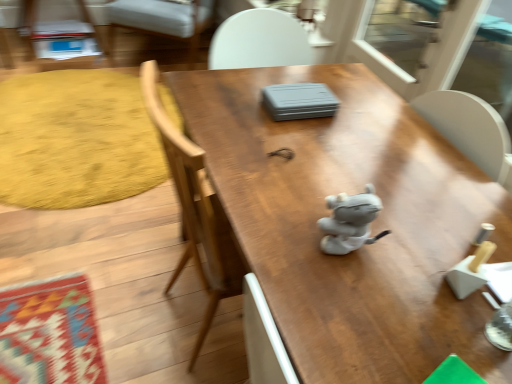
The image size is (512, 384). Find the location of `vacant space in front of gray fabric toy at center`. vacant space in front of gray fabric toy at center is located at coordinates (332, 276).